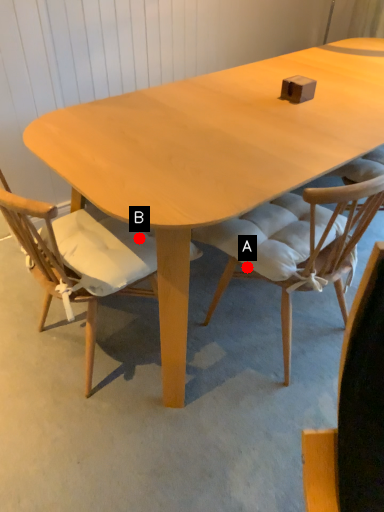
Question: Two points are circled on the image, labeled by A and B beside each circle. Which point is farther to the camera?

Choices:
 (A) A is further
 (B) B is further

Answer: (A)